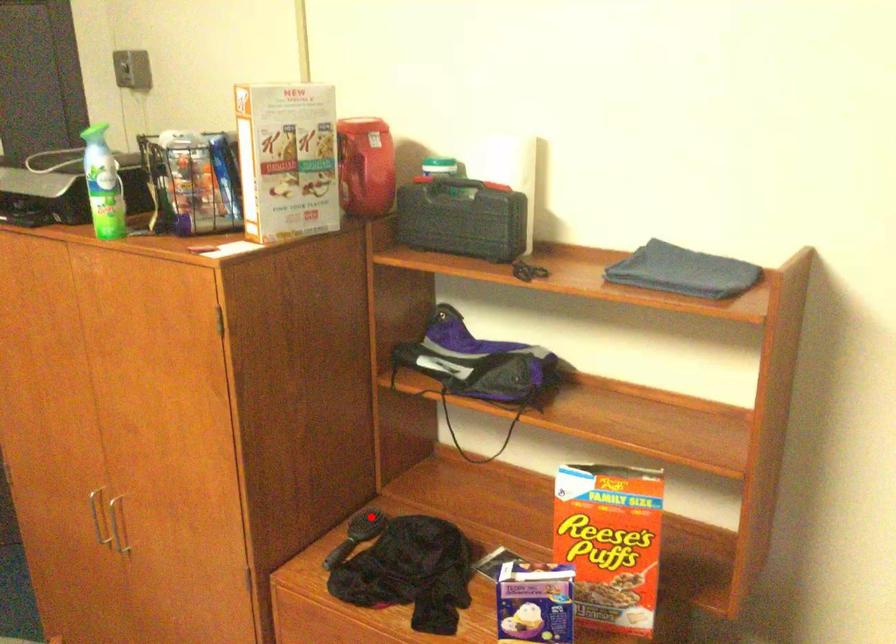
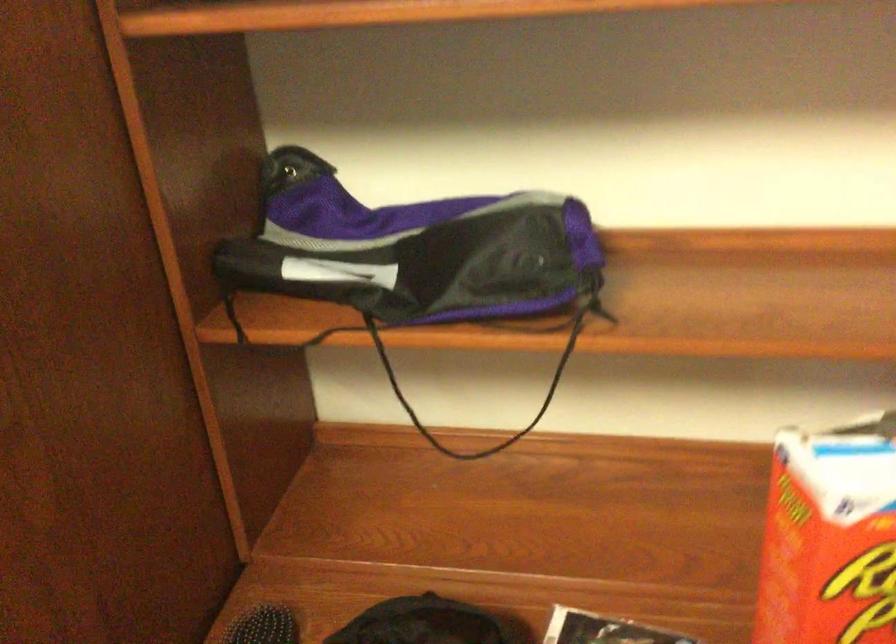
Question: A red point is marked in image1. In image2, is the corresponding 3D point closer to the camera or farther? Reply with the corresponding letter.

Choices:
 (A) The corresponding 3D point is closer.
 (B) The corresponding 3D point is farther.

Answer: (A)